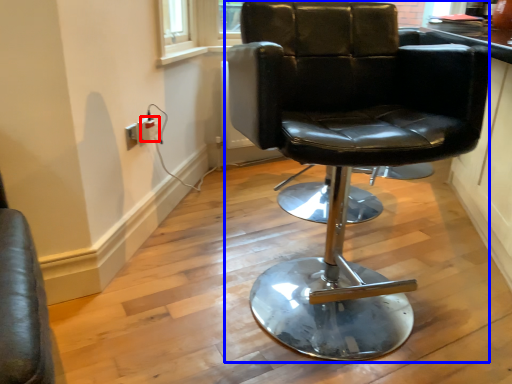
Question: Which object appears closest to the camera in this image, electric outlet (highlighted by a red box) or chair (highlighted by a blue box)?

Choices:
 (A) electric outlet
 (B) chair

Answer: (B)